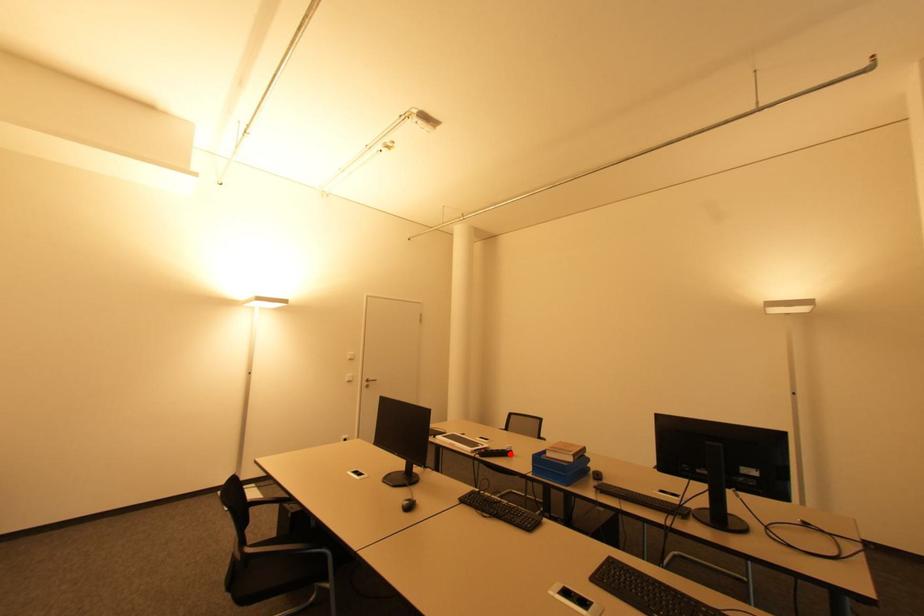
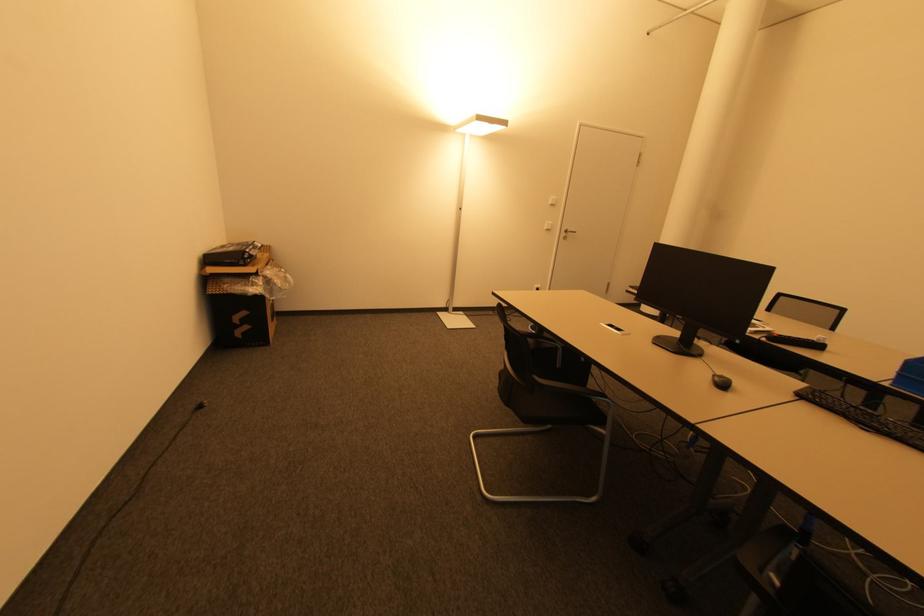
In the second image, find the point that corresponds to the highlighted location in the first image.

(819, 346)